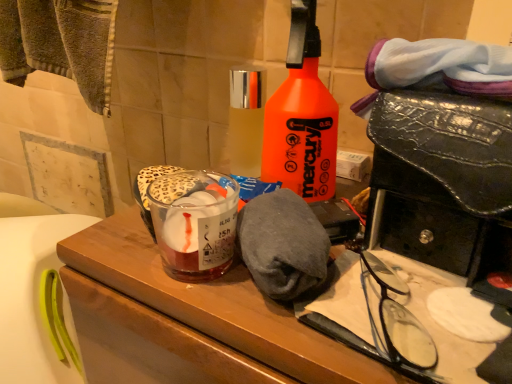
This screenshot has width=512, height=384. What do you see at coordinates (244, 122) in the screenshot?
I see `clear glass bottle at center, acting as the second bottle starting from the right` at bounding box center [244, 122].

Identify the location of wooden vanity at center. (190, 320).

Is translucent glass at center smaller than orange matte spray bottle at center, the 1th bottle viewed from the right?

Correct, translucent glass at center occupies less space than orange matte spray bottle at center, the 1th bottle viewed from the right.

Is translucent glass at center behind orange matte spray bottle at center, arranged as the second bottle when viewed from the left?

Yes, translucent glass at center is further from the camera.

Which of these two, translucent glass at center or orange matte spray bottle at center, arranged as the second bottle when viewed from the left, is thinner?

Thinner between the two is translucent glass at center.

Is translucent glass at center situated inside orange matte spray bottle at center, arranged as the second bottle when viewed from the left, or outside?

translucent glass at center is not enclosed by orange matte spray bottle at center, arranged as the second bottle when viewed from the left.

Would you say translucent glass at center is inside or outside clear glass bottle at center, acting as the second bottle starting from the right?

translucent glass at center is spatially situated outside clear glass bottle at center, acting as the second bottle starting from the right.

Measure the distance from translucent glass at center to clear glass bottle at center, acting as the 1th bottle starting from the left.

The distance of translucent glass at center from clear glass bottle at center, acting as the 1th bottle starting from the left, is 4.82 inches.

Looking at the image, does translucent glass at center seem bigger or smaller compared to clear glass bottle at center, acting as the 1th bottle starting from the left?

Clearly, translucent glass at center is larger in size than clear glass bottle at center, acting as the 1th bottle starting from the left.

Are translucent glass at center and clear glass bottle at center, acting as the second bottle starting from the right, beside each other?

No, translucent glass at center is not making contact with clear glass bottle at center, acting as the second bottle starting from the right.

From a real-world perspective, does clear glass bottle at center, acting as the 1th bottle starting from the left, stand above translucent glass at center?

Yes, from a real-world perspective, clear glass bottle at center, acting as the 1th bottle starting from the left, is above translucent glass at center.

How different are the orientations of clear glass bottle at center, acting as the second bottle starting from the right, and translucent glass at center in degrees?

There is a 0.533-degree angle between the facing directions of clear glass bottle at center, acting as the second bottle starting from the right, and translucent glass at center.

Between clear glass bottle at center, acting as the second bottle starting from the right, and translucent glass at center, which one appears on the right side from the viewer's perspective?

Positioned to the right is clear glass bottle at center, acting as the second bottle starting from the right.

Considering the positions of objects clear glass bottle at center, acting as the 1th bottle starting from the left, and translucent glass at center in the image provided, who is in front, clear glass bottle at center, acting as the 1th bottle starting from the left, or translucent glass at center?

translucent glass at center is more forward.

From a real-world perspective, is black plastic glasses at lower right under clear glass bottle at center, acting as the 1th bottle starting from the left?

Indeed, from a real-world perspective, black plastic glasses at lower right is positioned beneath clear glass bottle at center, acting as the 1th bottle starting from the left.

Is black plastic glasses at lower right oriented towards clear glass bottle at center, acting as the second bottle starting from the right?

No, black plastic glasses at lower right is not oriented towards clear glass bottle at center, acting as the second bottle starting from the right.

From the picture: Which object is positioned more to the left, black plastic glasses at lower right or clear glass bottle at center, acting as the 1th bottle starting from the left?

clear glass bottle at center, acting as the 1th bottle starting from the left.

Find the location of a particular element. The height and width of the screenshot is (384, 512). glasses below the clear glass bottle at center, acting as the 1th bottle starting from the left (from the image's perspective) is located at coordinates (401, 326).

Considering the relative sizes of clear glass bottle at center, acting as the 1th bottle starting from the left, and black plastic glasses at lower right in the image provided, is clear glass bottle at center, acting as the 1th bottle starting from the left, wider than black plastic glasses at lower right?

No.

Looking at this image, is clear glass bottle at center, acting as the 1th bottle starting from the left, oriented away from black plastic glasses at lower right?

No.

The width and height of the screenshot is (512, 384). I want to click on glasses on the right side of clear glass bottle at center, acting as the second bottle starting from the right, so click(401, 326).

Looking at this image, is black plastic glasses at lower right in contact with translucent glass at center?

They are not placed beside each other.

Can you tell me how much black plastic glasses at lower right and translucent glass at center differ in facing direction?

There is a 28-degree angle between the facing directions of black plastic glasses at lower right and translucent glass at center.

How much distance is there between black plastic glasses at lower right and translucent glass at center?

black plastic glasses at lower right is 16.13 centimeters away from translucent glass at center.

From a real-world perspective, between black plastic glasses at lower right and translucent glass at center, who is vertically higher?

translucent glass at center, from a real-world perspective.

Does orange matte spray bottle at center, arranged as the second bottle when viewed from the left, have a larger size compared to black plastic glasses at lower right?

Correct, orange matte spray bottle at center, arranged as the second bottle when viewed from the left, is larger in size than black plastic glasses at lower right.

Based on the photo, does orange matte spray bottle at center, the 1th bottle viewed from the right, have a greater height compared to black plastic glasses at lower right?

Yes, orange matte spray bottle at center, the 1th bottle viewed from the right, is taller than black plastic glasses at lower right.

Locate an element on the screen. glasses that is under the orange matte spray bottle at center, the 1th bottle viewed from the right (from a real-world perspective) is located at coordinates (401, 326).

How far apart are orange matte spray bottle at center, arranged as the second bottle when viewed from the left, and black plastic glasses at lower right?

The distance of orange matte spray bottle at center, arranged as the second bottle when viewed from the left, from black plastic glasses at lower right is 6.15 inches.

From the image's perspective, starting from the translucent glass at center, which bottle is the 2nd one above? Please provide its 2D coordinates.

[(301, 117)]

Where is `beverage lying in front of the clear glass bottle at center, acting as the second bottle starting from the right`? The width and height of the screenshot is (512, 384). beverage lying in front of the clear glass bottle at center, acting as the second bottle starting from the right is located at coordinates (194, 223).

From the image, which object appears to be nearer to black plastic glasses at lower right, clear glass bottle at center, acting as the second bottle starting from the right, or wooden vanity at center?

wooden vanity at center is positioned closer to the anchor black plastic glasses at lower right.

Looking at the image, which one is located further to clear glass bottle at center, acting as the second bottle starting from the right, translucent glass at center or orange matte spray bottle at center, arranged as the second bottle when viewed from the left?

translucent glass at center is positioned further to the anchor clear glass bottle at center, acting as the second bottle starting from the right.

Which object lies further to the anchor point wooden vanity at center, orange matte spray bottle at center, arranged as the second bottle when viewed from the left, or black plastic glasses at lower right?

orange matte spray bottle at center, arranged as the second bottle when viewed from the left, lies further to wooden vanity at center than the other object.

Considering their positions, is wooden vanity at center positioned further to clear glass bottle at center, acting as the second bottle starting from the right, than orange matte spray bottle at center, the 1th bottle viewed from the right?

Among the two, wooden vanity at center is located further to clear glass bottle at center, acting as the second bottle starting from the right.

When comparing their distances from translucent glass at center, does orange matte spray bottle at center, the 1th bottle viewed from the right, or wooden vanity at center seem further?

Among the two, orange matte spray bottle at center, the 1th bottle viewed from the right, is located further to translucent glass at center.

Based on their spatial positions, is wooden vanity at center or black plastic glasses at lower right further from clear glass bottle at center, acting as the 1th bottle starting from the left?

Based on the image, black plastic glasses at lower right appears to be further to clear glass bottle at center, acting as the 1th bottle starting from the left.

Looking at the image, which one is located closer to orange matte spray bottle at center, arranged as the second bottle when viewed from the left, translucent glass at center or clear glass bottle at center, acting as the 1th bottle starting from the left?

clear glass bottle at center, acting as the 1th bottle starting from the left.

Based on their spatial positions, is wooden vanity at center or black plastic glasses at lower right closer to orange matte spray bottle at center, the 1th bottle viewed from the right?

black plastic glasses at lower right is closer to orange matte spray bottle at center, the 1th bottle viewed from the right.

Find the location of a particular element. This screenshot has width=512, height=384. glasses between clear glass bottle at center, acting as the 1th bottle starting from the left, and wooden vanity at center in the up-down direction is located at coordinates 401,326.

This screenshot has width=512, height=384. Identify the location of glasses between translucent glass at center and wooden vanity at center in the up-down direction. (401, 326).

You are a GUI agent. You are given a task and a screenshot of the screen. Output one action in this format:
    pyautogui.click(x=<x>, y=<y>)
    Task: Click on the beverage between orange matte spray bottle at center, arranged as the second bottle when viewed from the left, and wooden vanity at center in the up-down direction
    
    Given the screenshot: What is the action you would take?
    pyautogui.click(x=194, y=223)

Locate an element on the screen. bottle between orange matte spray bottle at center, arranged as the second bottle when viewed from the left, and wooden vanity at center from top to bottom is located at coordinates (244, 122).